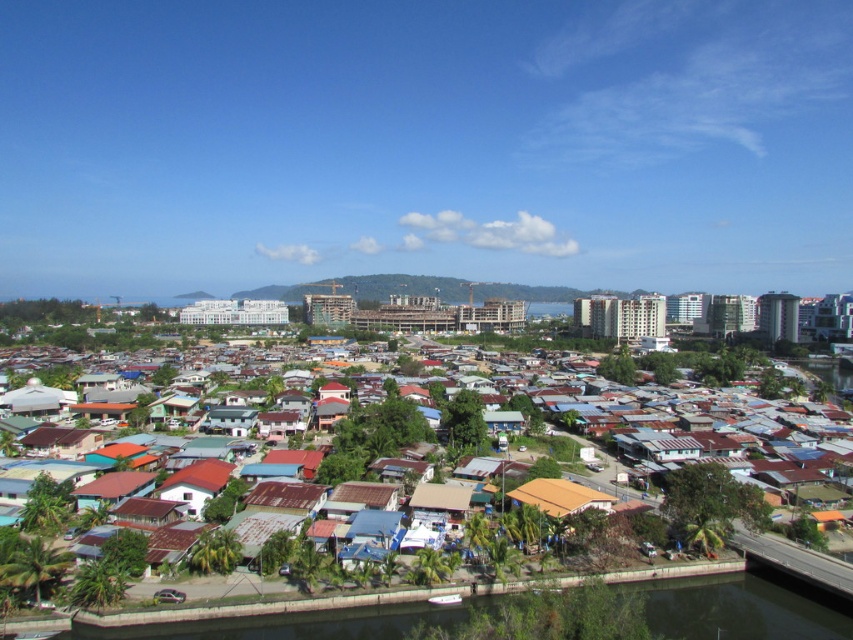
Is rusty corrugated metal hut at center further to the viewer compared to brown corrugated metal hut at center?

No, it is not.

This screenshot has height=640, width=853. In order to click on rusty corrugated metal hut at center in this screenshot , I will do `click(718, 432)`.